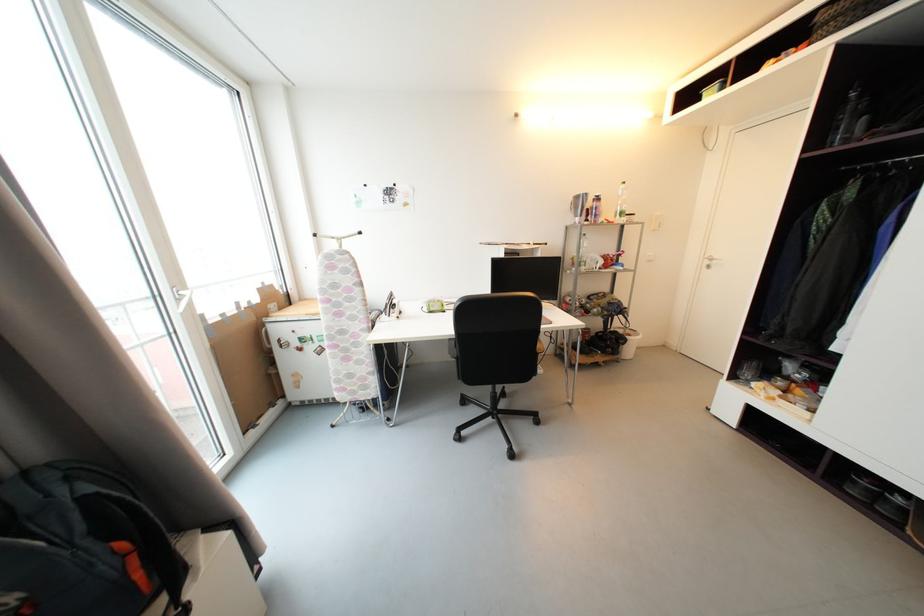
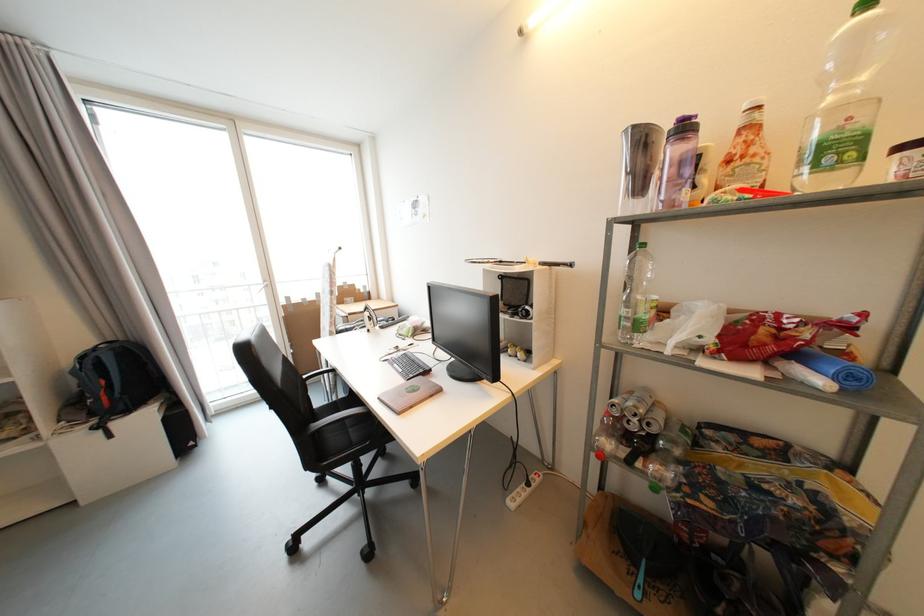
The point at (626,216) is marked in the first image. Where is the corresponding point in the second image?

(842, 151)